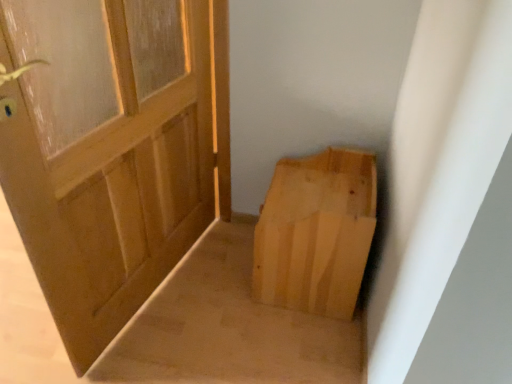
Question: Considering the relative sizes of natural wood door at left and natural wood cardboard box at lower right in the image provided, is natural wood door at left thinner than natural wood cardboard box at lower right?

Choices:
 (A) no
 (B) yes

Answer: (B)

Question: Would you say natural wood door at left is a long distance from natural wood cardboard box at lower right?

Choices:
 (A) yes
 (B) no

Answer: (B)

Question: Is natural wood door at left shorter than natural wood cardboard box at lower right?

Choices:
 (A) yes
 (B) no

Answer: (B)

Question: From the image's perspective, is natural wood door at left located above natural wood cardboard box at lower right?

Choices:
 (A) yes
 (B) no

Answer: (A)

Question: Is natural wood door at left further to camera compared to natural wood cardboard box at lower right?

Choices:
 (A) yes
 (B) no

Answer: (B)

Question: Is natural wood door at left outside natural wood cardboard box at lower right?

Choices:
 (A) yes
 (B) no

Answer: (A)

Question: Considering the relative sizes of natural wood cardboard box at lower right and natural wood door at left in the image provided, is natural wood cardboard box at lower right bigger than natural wood door at left?

Choices:
 (A) no
 (B) yes

Answer: (A)

Question: From the image's perspective, is natural wood cardboard box at lower right below natural wood door at left?

Choices:
 (A) yes
 (B) no

Answer: (A)

Question: Does natural wood cardboard box at lower right have a smaller size compared to natural wood door at left?

Choices:
 (A) no
 (B) yes

Answer: (B)

Question: From a real-world perspective, is natural wood cardboard box at lower right under natural wood door at left?

Choices:
 (A) no
 (B) yes

Answer: (B)

Question: Can you confirm if natural wood cardboard box at lower right is taller than natural wood door at left?

Choices:
 (A) no
 (B) yes

Answer: (A)

Question: Are natural wood cardboard box at lower right and natural wood door at left beside each other?

Choices:
 (A) yes
 (B) no

Answer: (B)

Question: Is natural wood cardboard box at lower right inside or outside of natural wood door at left?

Choices:
 (A) inside
 (B) outside

Answer: (B)